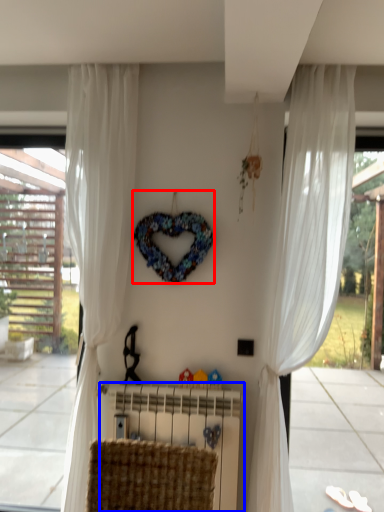
Question: Among these objects, which one is farthest to the camera, wreath (highlighted by a red box) or radiator (highlighted by a blue box)?

Choices:
 (A) wreath
 (B) radiator

Answer: (A)